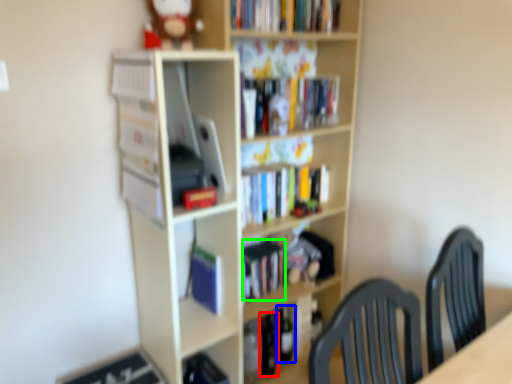
Question: Which is nearer to the wine bottle (highlighted by a red box)? wine bottle (highlighted by a blue box) or book (highlighted by a green box).

Choices:
 (A) wine bottle
 (B) book

Answer: (A)